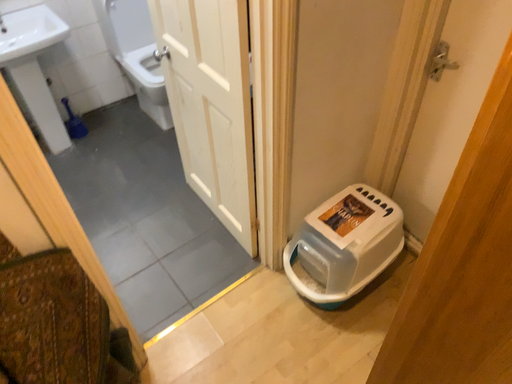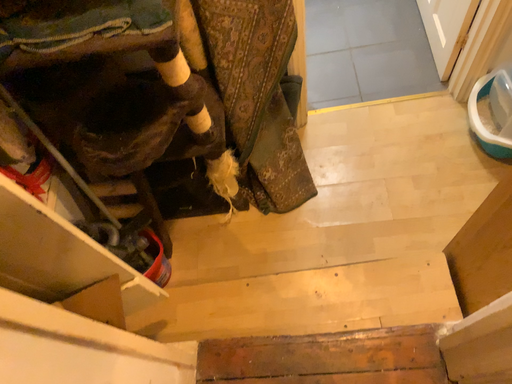
Question: Which way did the camera rotate in the video?

Choices:
 (A) rotated upward
 (B) rotated downward

Answer: (B)